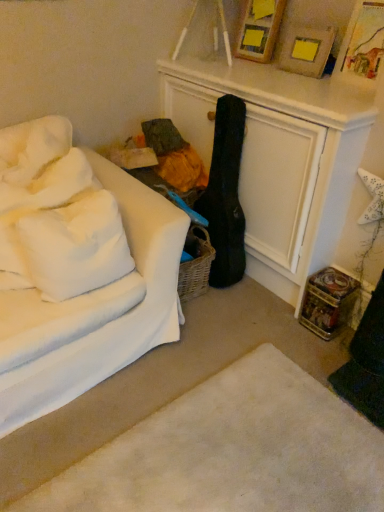
Locate an element on the screen. The image size is (384, 512). white fabric couch at left is located at coordinates (81, 276).

I want to click on wooden picture frame at upper right, the 1th picture frame viewed from the front, so click(306, 50).

Describe the element at coordinates (259, 30) in the screenshot. The height and width of the screenshot is (512, 384). I see `wooden picture frame at upper center, the first picture frame in the back-to-front sequence` at that location.

The width and height of the screenshot is (384, 512). Identify the location of white soft rug at lower center. (233, 451).

Which of these two, white soft rug at lower center or white soft pillow at upper left, which ranks as the 1th pillow in top-to-bottom order, stands shorter?

white soft rug at lower center.

From the image's perspective, is white soft rug at lower center over white soft pillow at upper left, which ranks as the 1th pillow in top-to-bottom order?

No, from the image's perspective, white soft rug at lower center is not on top of white soft pillow at upper left, which ranks as the 1th pillow in top-to-bottom order.

Is white soft rug at lower center not near white soft pillow at upper left, which is the second pillow from bottom to top?

Yes, white soft rug at lower center and white soft pillow at upper left, which is the second pillow from bottom to top, are located far from each other.

From a real-world perspective, does white soft pillow at left, which is the second pillow from top to bottom, stand above wooden picture frame at upper right, which ranks as the 2th picture frame in back-to-front order?

No, from a real-world perspective, white soft pillow at left, which is the second pillow from top to bottom, is not over wooden picture frame at upper right, which ranks as the 2th picture frame in back-to-front order

Can you confirm if white soft pillow at left, which is the second pillow from top to bottom, is bigger than wooden picture frame at upper right, the 1th picture frame viewed from the front?

Yes, white soft pillow at left, which is the second pillow from top to bottom, is bigger than wooden picture frame at upper right, the 1th picture frame viewed from the front.

Is point (88, 272) positioned after point (311, 42)?

No, (88, 272) is closer to viewer.

Does white soft pillow at left, which is the second pillow from top to bottom, have a lesser width compared to wooden picture frame at upper right, the 1th picture frame viewed from the front?

No, white soft pillow at left, which is the second pillow from top to bottom, is not thinner than wooden picture frame at upper right, the 1th picture frame viewed from the front.

From their relative heights in the image, would you say white soft rug at lower center is taller or shorter than wooden picture frame at upper right, which ranks as the 2th picture frame in back-to-front order?

white soft rug at lower center is shorter than wooden picture frame at upper right, which ranks as the 2th picture frame in back-to-front order.

Where is `the 1st picture frame above when counting from the white soft rug at lower center (from the image's perspective)`? The image size is (384, 512). the 1st picture frame above when counting from the white soft rug at lower center (from the image's perspective) is located at coordinates (306, 50).

From a real-world perspective, is white soft rug at lower center physically located above or below wooden picture frame at upper right, the 1th picture frame viewed from the front?

white soft rug at lower center is situated lower than wooden picture frame at upper right, the 1th picture frame viewed from the front, in the real world.

Is white soft pillow at left, which is the second pillow from top to bottom, outside of white soft pillow at upper left, which ranks as the 1th pillow in top-to-bottom order?

Yes, white soft pillow at left, which is the second pillow from top to bottom, is outside of white soft pillow at upper left, which ranks as the 1th pillow in top-to-bottom order.

Considering the relative sizes of white soft pillow at left, which is the second pillow from top to bottom, and white soft pillow at upper left, which is the second pillow from bottom to top, in the image provided, is white soft pillow at left, which is the second pillow from top to bottom, wider than white soft pillow at upper left, which is the second pillow from bottom to top,?

No.

Find the location of `pillow that is on the left side of white soft pillow at left, the 1th pillow positioned from the bottom`. pillow that is on the left side of white soft pillow at left, the 1th pillow positioned from the bottom is located at coordinates (32, 148).

Could you tell me if white soft pillow at left, the 1th pillow positioned from the bottom, is turned towards white soft pillow at upper left, which is the second pillow from bottom to top?

No, white soft pillow at left, the 1th pillow positioned from the bottom, is not turned towards white soft pillow at upper left, which is the second pillow from bottom to top.

Is point (73, 205) farther from viewer compared to point (69, 137)?

No, it is in front of (69, 137).

Consider the image. Between white fabric couch at left and white soft pillow at upper left, which is the second pillow from bottom to top, which one is positioned in front?

white fabric couch at left.

Between white fabric couch at left and white soft pillow at upper left, which is the second pillow from bottom to top, which one has less height?

white soft pillow at upper left, which is the second pillow from bottom to top.

In terms of width, does white fabric couch at left look wider or thinner when compared to white soft pillow at upper left, which ranks as the 1th pillow in top-to-bottom order?

white fabric couch at left is wider than white soft pillow at upper left, which ranks as the 1th pillow in top-to-bottom order.

Is wooden picture frame at upper center, the first picture frame in the back-to-front sequence, completely or partially inside white soft pillow at left, the 1th pillow positioned from the bottom?

That's incorrect, wooden picture frame at upper center, the first picture frame in the back-to-front sequence, is not inside white soft pillow at left, the 1th pillow positioned from the bottom.

Which object is positioned more to the left, white soft pillow at left, which is the second pillow from top to bottom, or wooden picture frame at upper center, the first picture frame in the back-to-front sequence?

white soft pillow at left, which is the second pillow from top to bottom, is more to the left.

Can you confirm if white soft pillow at left, the 1th pillow positioned from the bottom, is positioned to the left of white fabric couch at left?

No, white soft pillow at left, the 1th pillow positioned from the bottom, is not to the left of white fabric couch at left.

From the image's perspective, would you say white soft pillow at left, the 1th pillow positioned from the bottom, is shown under white fabric couch at left?

No.

Is white soft pillow at left, the 1th pillow positioned from the bottom, in front of or behind white fabric couch at left in the image?

Clearly, white soft pillow at left, the 1th pillow positioned from the bottom, is behind white fabric couch at left.

From a real-world perspective, does white soft pillow at left, the 1th pillow positioned from the bottom, stand above white fabric couch at left?

Yes, from a real-world perspective, white soft pillow at left, the 1th pillow positioned from the bottom, is on top of white fabric couch at left.

At what (x,y) coordinates should I click in order to perform the action: click on the 2nd pillow behind when counting from the white soft rug at lower center. Please return your answer as a coordinate pair (x, y). Looking at the image, I should click on (32, 148).

Where is `the 1st picture frame positioned above the white soft pillow at left, which is the second pillow from top to bottom (from the image's perspective)`? The height and width of the screenshot is (512, 384). the 1st picture frame positioned above the white soft pillow at left, which is the second pillow from top to bottom (from the image's perspective) is located at coordinates (306, 50).

When comparing their distances from white fabric couch at left, does white soft pillow at left, the 1th pillow positioned from the bottom, or white soft pillow at upper left, which ranks as the 1th pillow in top-to-bottom order, seem closer?

white soft pillow at left, the 1th pillow positioned from the bottom, is positioned closer to the anchor white fabric couch at left.

Considering their positions, is white fabric couch at left positioned further to white soft pillow at left, which is the second pillow from top to bottom, than white soft rug at lower center?

The object further to white soft pillow at left, which is the second pillow from top to bottom, is white soft rug at lower center.

Which object lies nearer to the anchor point wooden picture frame at upper right, which ranks as the 2th picture frame in back-to-front order, white soft pillow at upper left, which ranks as the 1th pillow in top-to-bottom order, or white soft rug at lower center?

white soft pillow at upper left, which ranks as the 1th pillow in top-to-bottom order, is positioned closer to the anchor wooden picture frame at upper right, which ranks as the 2th picture frame in back-to-front order.

Looking at the image, which one is located closer to white soft pillow at left, the 1th pillow positioned from the bottom, white fabric couch at left or wooden picture frame at upper right, the 1th picture frame viewed from the front?

The object closer to white soft pillow at left, the 1th pillow positioned from the bottom, is white fabric couch at left.

Which object lies nearer to the anchor point white soft pillow at left, which is the second pillow from top to bottom, white fabric couch at left or wooden picture frame at upper center, the first picture frame in the back-to-front sequence?

white fabric couch at left is closer to white soft pillow at left, which is the second pillow from top to bottom.

From the image, which object appears to be farther from white soft rug at lower center, white fabric couch at left or white soft pillow at left, the 1th pillow positioned from the bottom?

white soft pillow at left, the 1th pillow positioned from the bottom, lies further to white soft rug at lower center than the other object.

Considering their positions, is white soft pillow at upper left, which is the second pillow from bottom to top, positioned closer to white soft pillow at left, which is the second pillow from top to bottom, than wooden picture frame at upper right, which ranks as the 2th picture frame in back-to-front order?

white soft pillow at upper left, which is the second pillow from bottom to top, is positioned closer to the anchor white soft pillow at left, which is the second pillow from top to bottom.

Consider the image. From the image, which object appears to be nearer to white fabric couch at left, white soft rug at lower center or white soft pillow at upper left, which is the second pillow from bottom to top?

white soft pillow at upper left, which is the second pillow from bottom to top.

Find the location of a particular element. This screenshot has height=512, width=384. picture frame between wooden picture frame at upper center, the first picture frame in the back-to-front sequence, and white fabric couch at left, in the vertical direction is located at coordinates (306, 50).

The width and height of the screenshot is (384, 512). In order to click on studio couch between white soft pillow at upper left, which ranks as the 1th pillow in top-to-bottom order, and wooden picture frame at upper right, the 1th picture frame viewed from the front in this screenshot , I will do `click(81, 276)`.

Identify the location of picture frame that lies between wooden picture frame at upper center, the first picture frame in the back-to-front sequence, and white soft pillow at left, the 1th pillow positioned from the bottom, from top to bottom. The width and height of the screenshot is (384, 512). (306, 50).

What are the coordinates of `pillow between white fabric couch at left and white soft pillow at upper left, which is the second pillow from bottom to top, along the z-axis` in the screenshot? It's located at (75, 246).